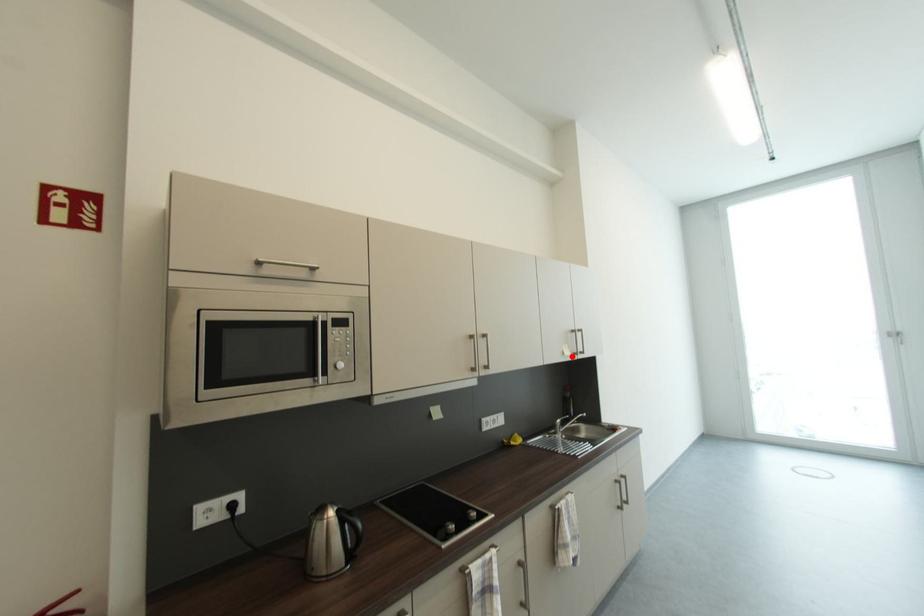
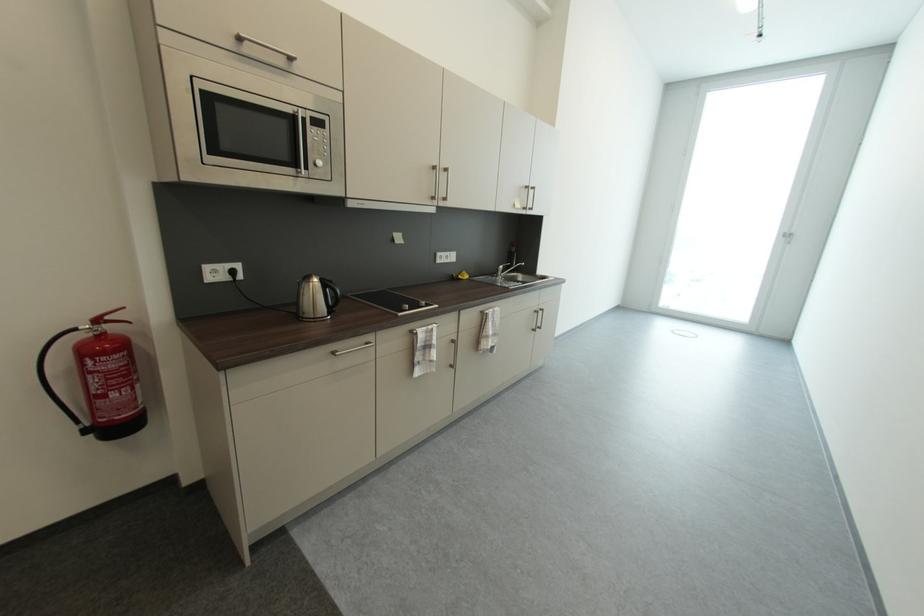
Question: I am providing you with two images of the same scene from different viewpoints. In image1, a red point is highlighted. Considering the same 3D point in image2, which of the following is correct?

Choices:
 (A) It is closer
 (B) It is farther

Answer: (A)